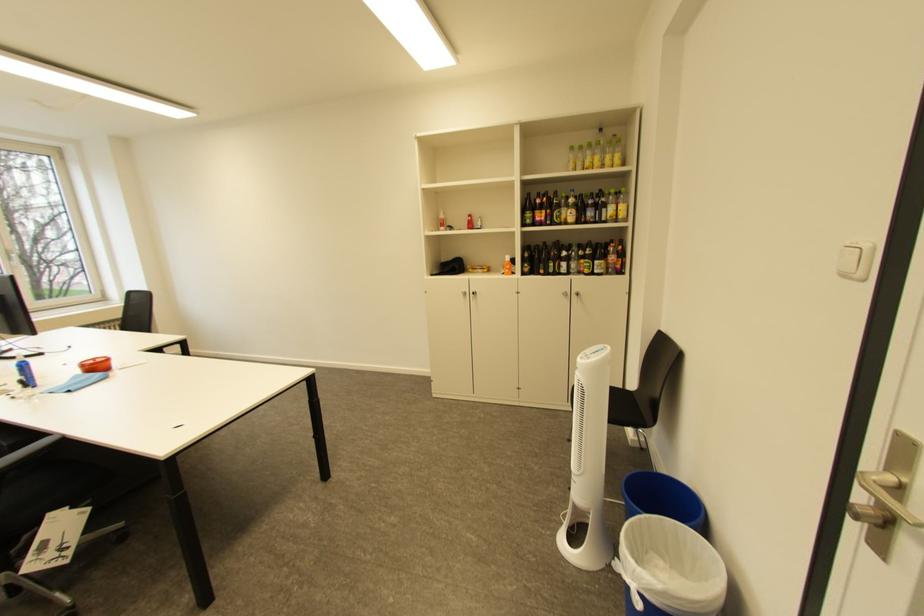
What do you see at coordinates (588, 464) in the screenshot?
I see `the white tower fan` at bounding box center [588, 464].